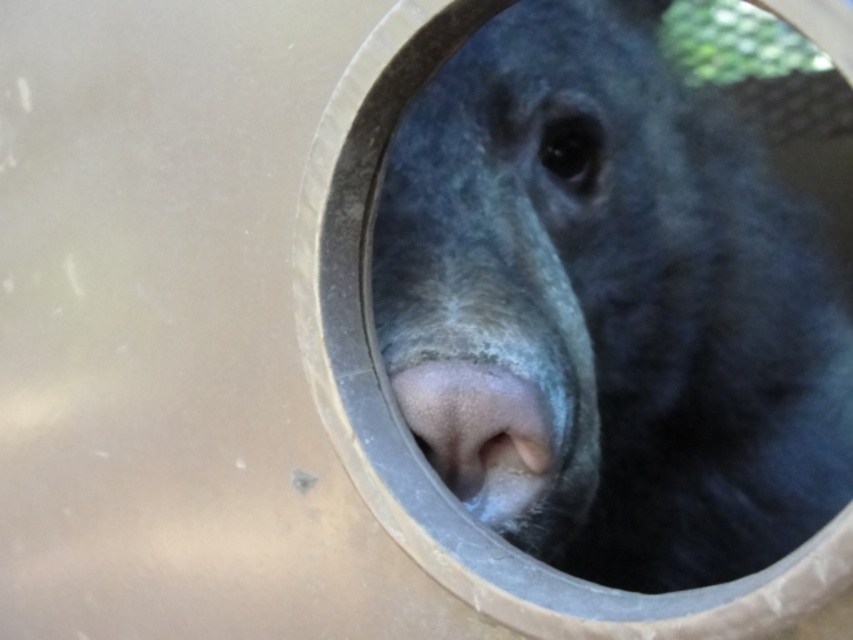
Question: Which point is closer to the camera taking this photo?

Choices:
 (A) (490, 216)
 (B) (529, 406)

Answer: (B)

Question: Among these points, which one is farthest from the camera?

Choices:
 (A) (552, 540)
 (B) (454, 369)

Answer: (A)

Question: Can you confirm if fuzzy black bear at center is positioned to the right of gray matte nose at center?

Choices:
 (A) no
 (B) yes

Answer: (B)

Question: Can you confirm if fuzzy black bear at center is positioned to the left of gray matte nose at center?

Choices:
 (A) no
 (B) yes

Answer: (A)

Question: Which of the following is the farthest from the observer?

Choices:
 (A) fuzzy black bear at center
 (B) gray matte nose at center

Answer: (B)

Question: Is fuzzy black bear at center to the right of gray matte nose at center from the viewer's perspective?

Choices:
 (A) no
 (B) yes

Answer: (B)